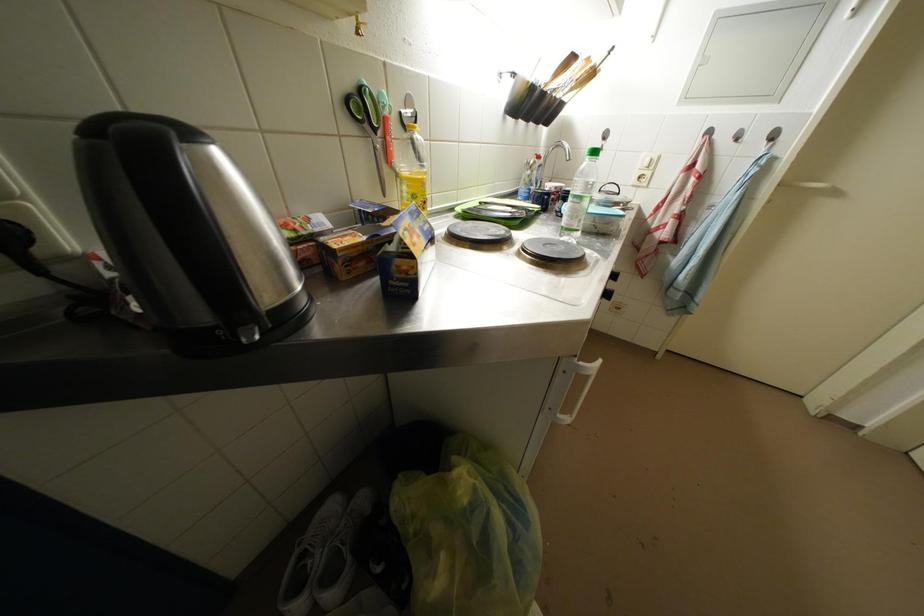
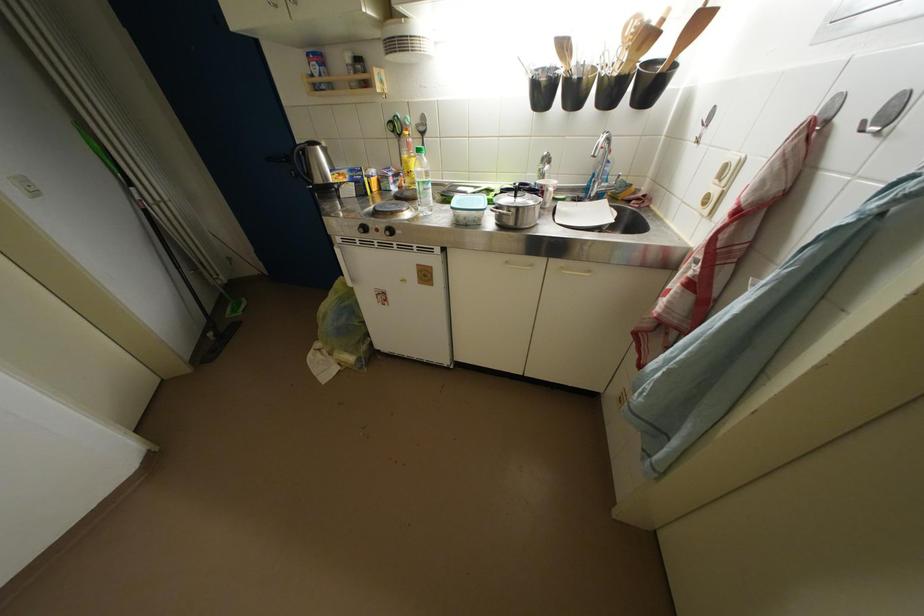
Where in the second image is the point corresponding to the point at 744,145 from the first image?

(869, 132)